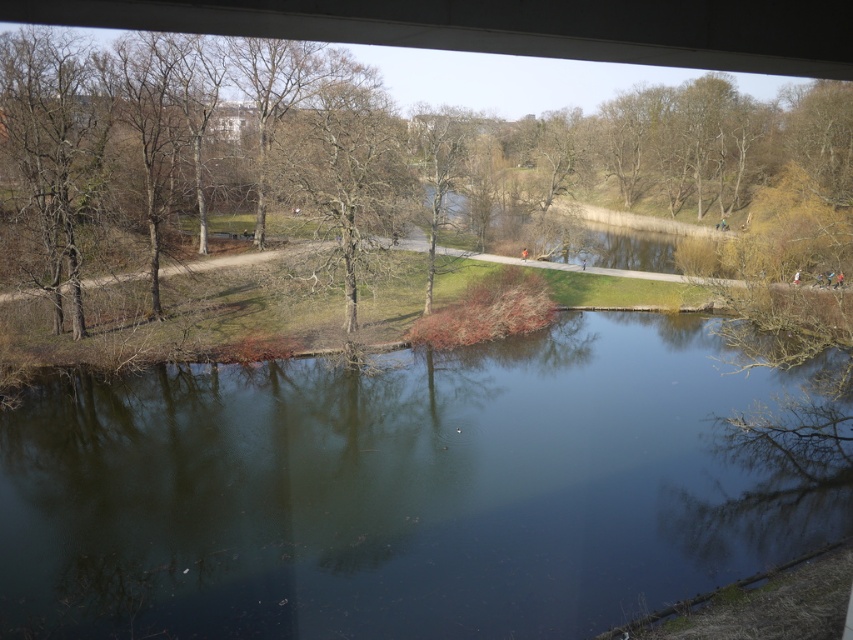
Question: Is dark blue water at center closer to the viewer compared to brown leafless tree at lower left?

Choices:
 (A) yes
 (B) no

Answer: (A)

Question: Based on their relative distances, which object is farther from the dark blue water at center?

Choices:
 (A) bare branches at center
 (B) brown leafless tree at lower left

Answer: (B)

Question: Which of the following is the farthest from the observer?

Choices:
 (A) (732, 196)
 (B) (364, 86)
 (C) (561, 628)

Answer: (A)

Question: Considering the real-world distances, which object is closest to the brown leafless tree at lower left?

Choices:
 (A) bare branches at center
 (B) dark blue water at center

Answer: (A)

Question: From the image, what is the correct spatial relationship of dark blue water at center in relation to bare branches at center?

Choices:
 (A) below
 (B) above

Answer: (A)

Question: Can you confirm if dark blue water at center is positioned to the right of bare branches at center?

Choices:
 (A) yes
 (B) no

Answer: (A)